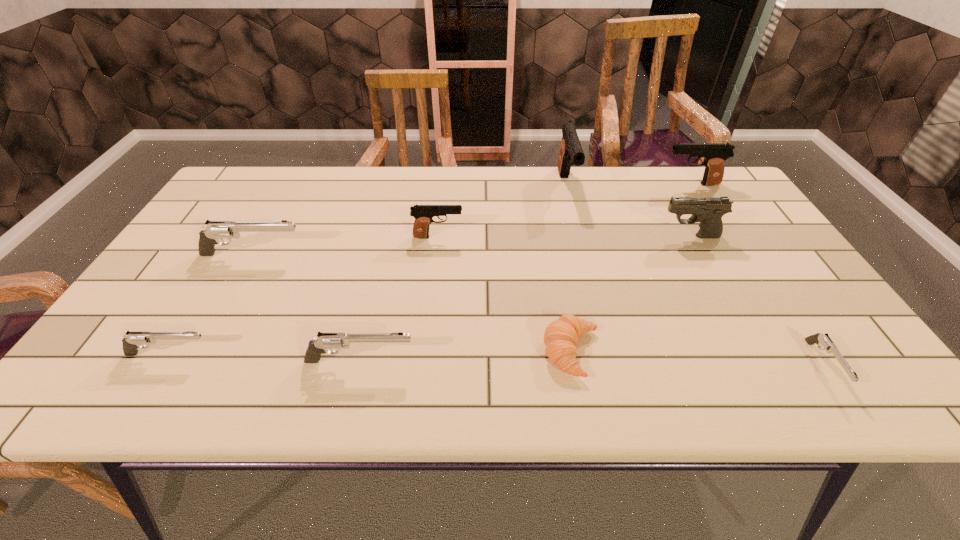
You are a GUI agent. You are given a task and a screenshot of the screen. Output one action in this format:
    pyautogui.click(x=<x>, y=<y>)
    Task: Click on the object that is at the near right corner
    This screenshot has width=960, height=540.
    Given the screenshot: What is the action you would take?
    pyautogui.click(x=828, y=345)

This screenshot has width=960, height=540. In the image, there is a desktop. Identify the location of vacant area at the far edge. (370, 186).

This screenshot has width=960, height=540. Identify the location of free space at the near edge of the desktop. (767, 368).

The height and width of the screenshot is (540, 960). Find the location of `vacant space that's between the biggest silver pistol and the third shortest pistol`. vacant space that's between the biggest silver pistol and the third shortest pistol is located at coordinates (306, 308).

Locate an element on the screen. Image resolution: width=960 pixels, height=540 pixels. vacant area that lies between the biggest black pistol and the smallest black pistol is located at coordinates (502, 211).

The height and width of the screenshot is (540, 960). In order to click on free space between the smallest black pistol and the fourth pistol from right to left in this screenshot , I will do `click(502, 211)`.

You are a GUI agent. You are given a task and a screenshot of the screen. Output one action in this format:
    pyautogui.click(x=<x>, y=<y>)
    Task: Click on the vacant region between the shortest pistol and the third shortest object
    The image size is (960, 540).
    Given the screenshot: What is the action you would take?
    pyautogui.click(x=496, y=360)

In order to click on free spot between the smallest silver pistol and the tallest pistol in this screenshot , I will do `click(695, 275)`.

I want to click on free space between the farthest silver pistol and the third biggest silver pistol, so [211, 305].

Image resolution: width=960 pixels, height=540 pixels. I want to click on vacant area that lies between the smallest black pistol and the sixth tallest object, so click(x=398, y=299).